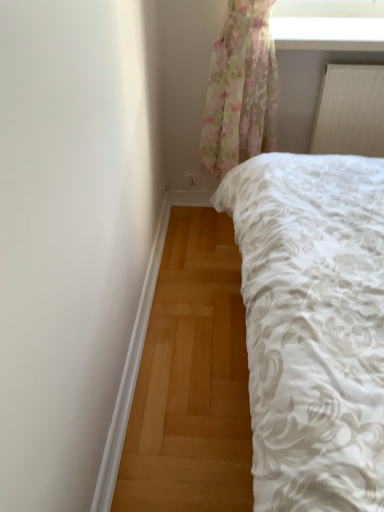
Question: Does transparent floral curtain at upper center have a lesser width compared to white smooth trim at lower left?

Choices:
 (A) yes
 (B) no

Answer: (B)

Question: Can you confirm if transparent floral curtain at upper center is positioned to the right of white smooth trim at lower left?

Choices:
 (A) no
 (B) yes

Answer: (B)

Question: Is transparent floral curtain at upper center not within white smooth trim at lower left?

Choices:
 (A) yes
 (B) no

Answer: (A)

Question: Is transparent floral curtain at upper center surrounding white smooth trim at lower left?

Choices:
 (A) yes
 (B) no

Answer: (B)

Question: From the image's perspective, does transparent floral curtain at upper center appear higher than white smooth trim at lower left?

Choices:
 (A) no
 (B) yes

Answer: (B)

Question: Is transparent floral curtain at upper center positioned before white smooth trim at lower left?

Choices:
 (A) yes
 (B) no

Answer: (B)

Question: Does transparent floral curtain at upper center have a larger size compared to white matte radiator at upper right?

Choices:
 (A) yes
 (B) no

Answer: (A)

Question: From the image's perspective, would you say transparent floral curtain at upper center is positioned over white matte radiator at upper right?

Choices:
 (A) no
 (B) yes

Answer: (B)

Question: Can you confirm if transparent floral curtain at upper center is positioned to the left of white matte radiator at upper right?

Choices:
 (A) no
 (B) yes

Answer: (B)

Question: Is transparent floral curtain at upper center facing away from white matte radiator at upper right?

Choices:
 (A) yes
 (B) no

Answer: (B)

Question: Can you confirm if transparent floral curtain at upper center is wider than white matte radiator at upper right?

Choices:
 (A) no
 (B) yes

Answer: (B)

Question: Considering the relative positions of transparent floral curtain at upper center and white matte radiator at upper right in the image provided, is transparent floral curtain at upper center behind white matte radiator at upper right?

Choices:
 (A) yes
 (B) no

Answer: (B)

Question: Does white smooth trim at lower left have a smaller size compared to white matte radiator at upper right?

Choices:
 (A) yes
 (B) no

Answer: (A)